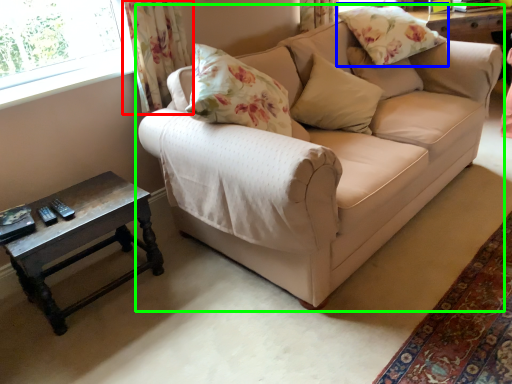
Question: Based on their relative distances, which object is nearer to curtain (highlighted by a red box)? Choose from pillow (highlighted by a blue box) and studio couch (highlighted by a green box).

Choices:
 (A) pillow
 (B) studio couch

Answer: (B)